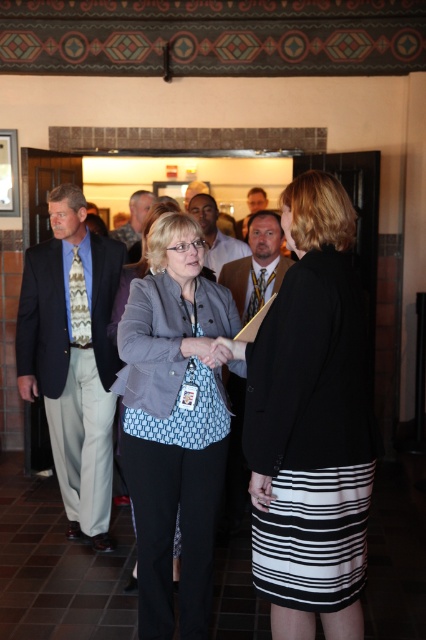
Question: Which point appears farthest from the camera in this image?

Choices:
 (A) (204, 264)
 (B) (288, 308)
 (C) (106, 268)
 (D) (259, 198)

Answer: (D)

Question: Is black textured blazer at center positioned behind matte gray blazer at center?

Choices:
 (A) no
 (B) yes

Answer: (A)

Question: Which object appears farthest from the camera in this image?

Choices:
 (A) blue printed blouse at center
 (B) matte gray blazer at center

Answer: (B)

Question: Considering the real-world distances, which object is closest to the light brown leather jacket at center?

Choices:
 (A) black textured blazer at center
 (B) light brown wood chair at center
 (C) blue printed blouse at center

Answer: (B)

Question: Observing the image, what is the correct spatial positioning of matte blue shirt at center in reference to matte gray blazer at center?

Choices:
 (A) left
 (B) right

Answer: (A)

Question: Can you confirm if blue printed blouse at center is wider than light brown wood chair at center?

Choices:
 (A) yes
 (B) no

Answer: (A)